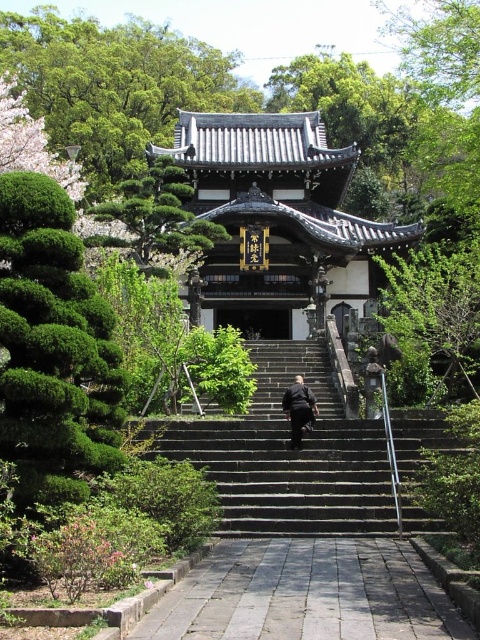
You are standing at the base of the temple steps and want to take a photo of the temple entrance. To avoid having the green leafy tree at upper center in your shot, where should you position yourself relative to the temple?

The green leafy tree at upper center is located at point (x=115, y=84), so to avoid it in your photo, position yourself slightly to the right or left of the temple entrance to shift the frame away from the tree.

You are standing at the bottom of the dark gray stone stairs at center and want to reach the entrance of the temple. Which direction should you look to see the green leafy tree at upper center?

The dark gray stone stairs at center is to the right of green leafy tree at upper center, so you should look to your left to see the green leafy tree at upper center.